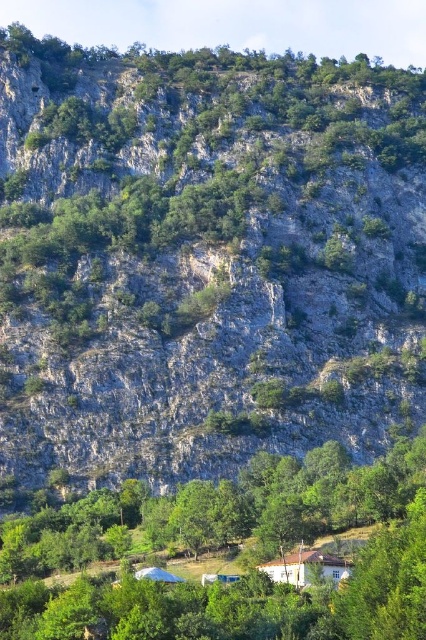
Does green leafy tree at center have a larger size compared to white wooden house at lower center?

Yes, green leafy tree at center is bigger than white wooden house at lower center.

Is green leafy tree at center positioned at the back of white wooden house at lower center?

No.

The width and height of the screenshot is (426, 640). Describe the element at coordinates (227, 547) in the screenshot. I see `green leafy tree at center` at that location.

I want to click on green leafy tree at center, so click(227, 547).